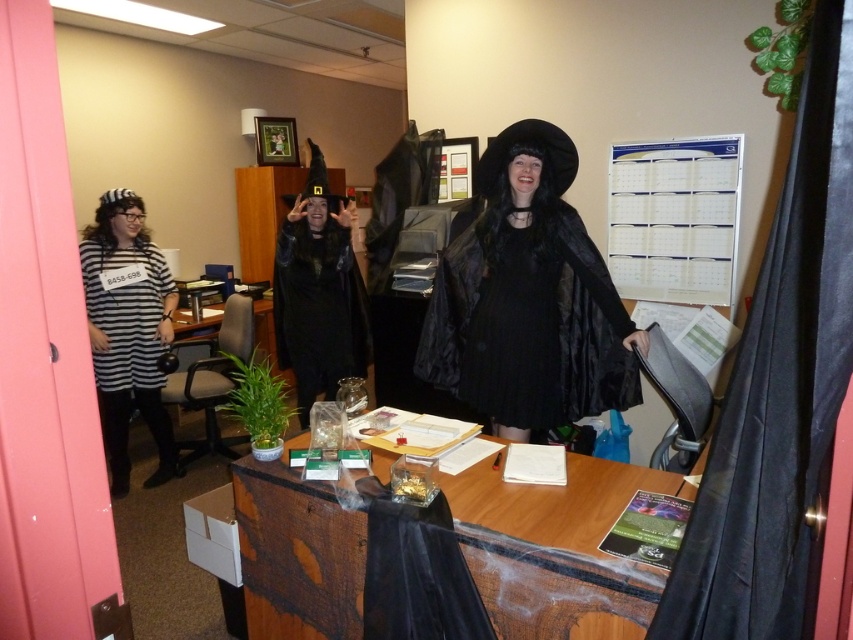
Between matte black dress at center and striped fabric shirt at left, which one appears on the left side from the viewer's perspective?

From the viewer's perspective, striped fabric shirt at left appears more on the left side.

The image size is (853, 640). Find the location of `matte black dress at center`. matte black dress at center is located at coordinates (527, 298).

Image resolution: width=853 pixels, height=640 pixels. In order to click on matte black dress at center in this screenshot , I will do `click(527, 298)`.

Is wooden table at center below matte black dress at center?

Yes, wooden table at center is below matte black dress at center.

Can you confirm if wooden table at center is wider than matte black dress at center?

Yes.

Is point (248, 470) positioned behind point (518, 176)?

No, it is in front of (518, 176).

Where is `wooden table at center`? The width and height of the screenshot is (853, 640). wooden table at center is located at coordinates (556, 547).

Does matte black dress at center appear on the right side of black matte robe at center?

Correct, you'll find matte black dress at center to the right of black matte robe at center.

Does matte black dress at center appear on the left side of black matte robe at center?

Incorrect, matte black dress at center is not on the left side of black matte robe at center.

Is point (492, 250) positioned in front of point (350, 358)?

Yes, it is in front of point (350, 358).

Where is `matte black dress at center`? This screenshot has width=853, height=640. matte black dress at center is located at coordinates (527, 298).